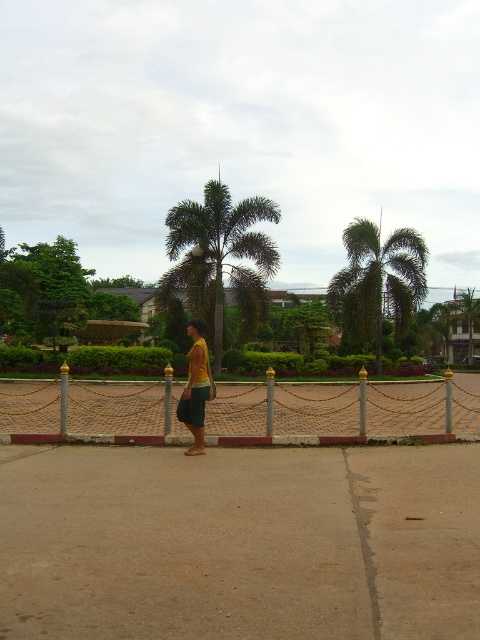
Who is positioned more to the left, gold chain-link fence at center or green leafy palm at center?

From the viewer's perspective, green leafy palm at center appears more on the left side.

Is point (57, 394) farther from camera compared to point (224, 184)?

No, it is not.

Image resolution: width=480 pixels, height=640 pixels. I want to click on gold chain-link fence at center, so click(344, 412).

Which is behind, point (419, 234) or point (197, 452)?

The point (419, 234) is more distant.

Can you confirm if green leafy palm tree at center is taller than yellow matte shirt at center?

Yes, green leafy palm tree at center is taller than yellow matte shirt at center.

Find the location of a particular element. This screenshot has width=480, height=640. green leafy palm tree at center is located at coordinates (377, 282).

Where is `green leafy palm tree at center`? Image resolution: width=480 pixels, height=640 pixels. green leafy palm tree at center is located at coordinates (377, 282).

Can you confirm if brown concrete pavement at center is positioned to the right of gold chain-link fence at center?

In fact, brown concrete pavement at center is to the left of gold chain-link fence at center.

Who is positioned more to the right, brown concrete pavement at center or gold chain-link fence at center?

gold chain-link fence at center is more to the right.

Which is in front, point (254, 460) or point (339, 422)?

Positioned in front is point (254, 460).

Find the location of a particular element. The width and height of the screenshot is (480, 640). brown concrete pavement at center is located at coordinates (240, 541).